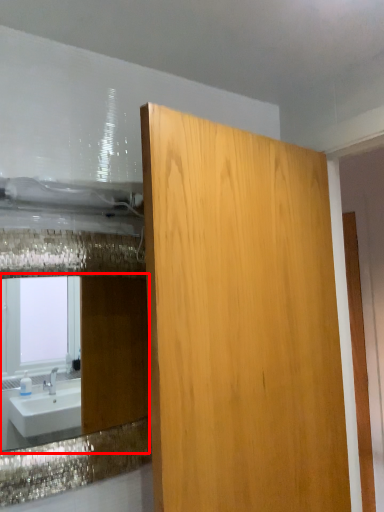
Question: From the image's perspective, considering the relative positions of mirror (annotated by the red box) and bathroom cabinet in the image provided, where is mirror (annotated by the red box) located with respect to the staircase?

Choices:
 (A) above
 (B) below

Answer: (B)